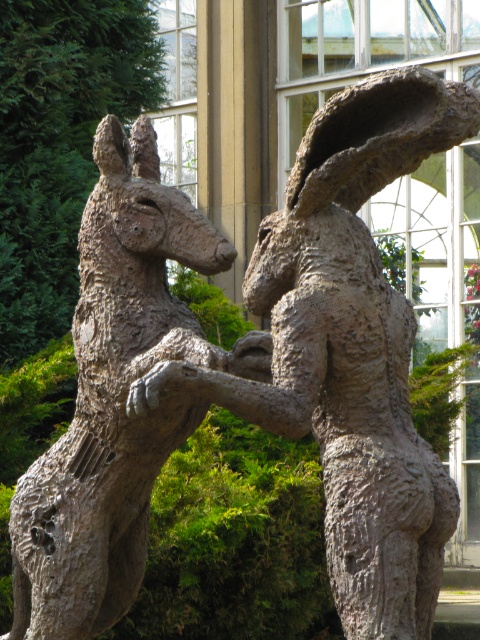
Question: Among these objects, which one is nearest to the camera?

Choices:
 (A) rough bronze sculpture at center
 (B) rustic stone kangaroo at center

Answer: (A)

Question: Which of the following is the farthest from the observer?

Choices:
 (A) (430, 148)
 (B) (126, 346)

Answer: (B)

Question: Which point is farther from the camera taking this photo?

Choices:
 (A) (420, 84)
 (B) (96, 454)

Answer: (B)

Question: Is rough bronze sculpture at center further to the viewer compared to rustic stone kangaroo at center?

Choices:
 (A) no
 (B) yes

Answer: (A)

Question: Observing the image, what is the correct spatial positioning of rough bronze sculpture at center in reference to rustic stone kangaroo at center?

Choices:
 (A) above
 (B) below

Answer: (A)

Question: Can you confirm if rough bronze sculpture at center is positioned below rustic stone kangaroo at center?

Choices:
 (A) yes
 (B) no

Answer: (B)